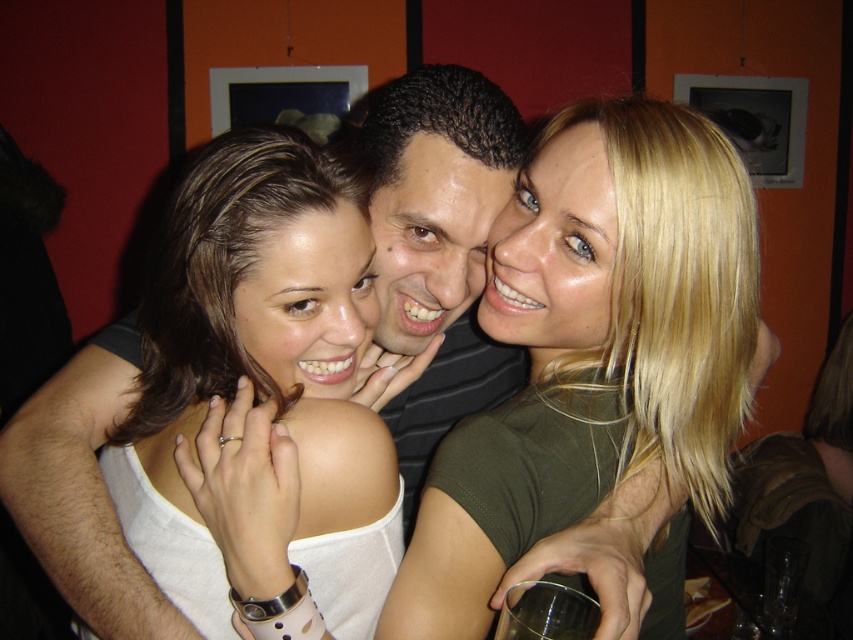
Question: Can you confirm if matte olive green shirt at center is positioned to the right of dark brown curly hair at center?

Choices:
 (A) yes
 (B) no

Answer: (A)

Question: Which object is farther from the camera taking this photo?

Choices:
 (A) dark brown curly hair at center
 (B) matte olive green shirt at center
 (C) white matte tank top at center

Answer: (A)

Question: Can you confirm if matte olive green shirt at center is wider than dark brown curly hair at center?

Choices:
 (A) yes
 (B) no

Answer: (A)

Question: Which object appears closest to the camera in this image?

Choices:
 (A) dark brown curly hair at center
 (B) matte olive green shirt at center

Answer: (B)

Question: Which of the following is the closest to the observer?

Choices:
 (A) matte olive green shirt at center
 (B) dark brown curly hair at center

Answer: (A)

Question: Is white matte tank top at center thinner than dark brown curly hair at center?

Choices:
 (A) yes
 (B) no

Answer: (B)